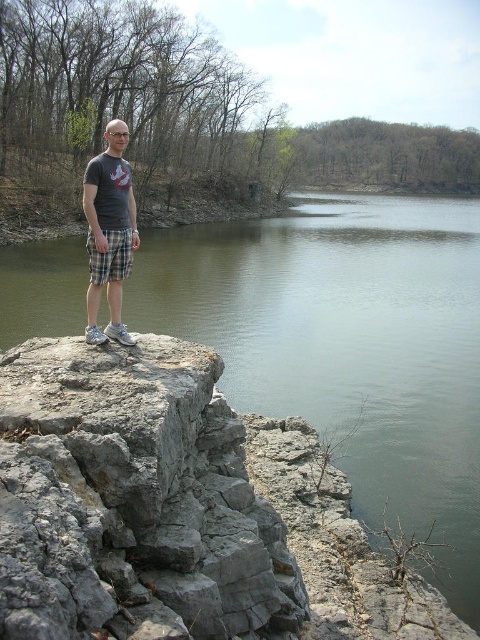
You are a photographer standing at the edge of a rocky outcrop. You want to take a photo of the gray rough rock at center while ensuring the person in the scene is not in the shot. Given that the photographer is 6 feet tall, can you determine if the rock is far enough away from the photographer to avoid the person appearing in the frame?

The gray rough rock at center is 9.42 feet away from the camera. Since the photographer is 6 feet tall, the rock is positioned beyond the photographer, so the person in the scene will not appear in the frame.